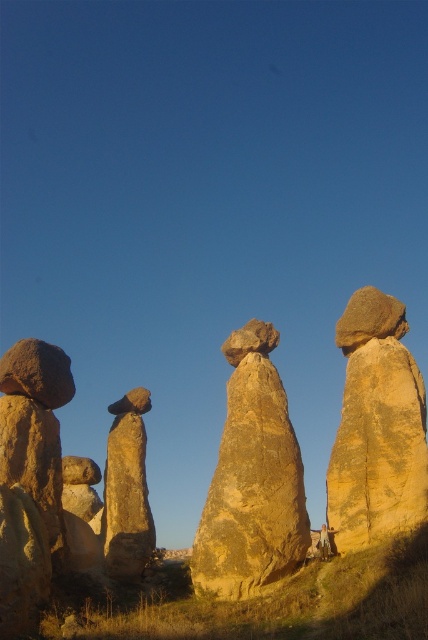
Can you confirm if yellow sandstone rock at center is positioned to the right of yellowish sandstone rock at right?

In fact, yellow sandstone rock at center is to the left of yellowish sandstone rock at right.

Can you confirm if yellow sandstone rock at center is wider than yellowish sandstone rock at right?

In fact, yellow sandstone rock at center might be narrower than yellowish sandstone rock at right.

Between point (282, 513) and point (347, 340), which one is positioned behind?

Positioned behind is point (347, 340).

The width and height of the screenshot is (428, 640). Find the location of `yellow sandstone rock at center`. yellow sandstone rock at center is located at coordinates (252, 480).

Does yellow sandstone rock at center have a lesser height compared to smooth sandstone rock at center?

No, yellow sandstone rock at center is not shorter than smooth sandstone rock at center.

Between point (273, 524) and point (106, 556), which one is positioned behind?

Positioned behind is point (106, 556).

Locate an element on the screen. Image resolution: width=428 pixels, height=640 pixels. yellow sandstone rock at center is located at coordinates (252, 480).

Is yellowish sandstone rock formation at center above smooth sandstone rock at center?

Correct, yellowish sandstone rock formation at center is located above smooth sandstone rock at center.

Which is more to the left, yellowish sandstone rock formation at center or smooth sandstone rock at center?

Positioned to the left is smooth sandstone rock at center.

Identify the location of yellowish sandstone rock formation at center. This screenshot has height=640, width=428. (253, 486).